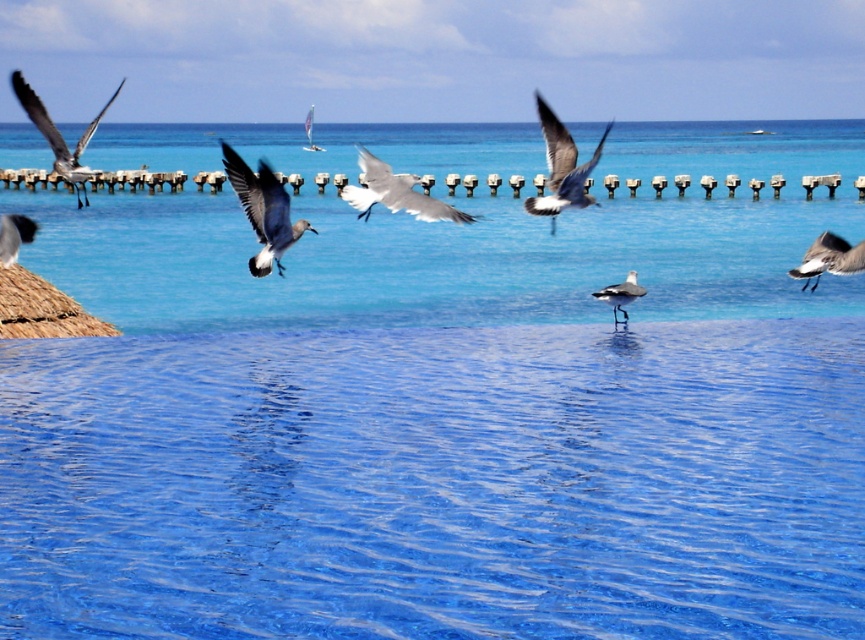
Question: Which point is closer to the camera?

Choices:
 (A) gray matte seagull at upper left
 (B) white glossy seagull at center
 (C) white matte bird at center
 (D) white feathered seagull at right

Answer: (B)

Question: Does white glossy seagull at center appear on the right side of matte black bird at left?

Choices:
 (A) yes
 (B) no

Answer: (A)

Question: Which object is farther from the camera taking this photo?

Choices:
 (A) gray matte seagull at upper center
 (B) white matte bird at center

Answer: (B)

Question: Does gray matte seagull at upper center have a larger size compared to matte black bird at left?

Choices:
 (A) yes
 (B) no

Answer: (A)

Question: Based on their relative distances, which object is nearer to the gray matte seagull at upper left?

Choices:
 (A) white matte bird at center
 (B) gray matte seagull at center

Answer: (B)

Question: Is white glossy seagull at center further to the viewer compared to white matte bird at center?

Choices:
 (A) no
 (B) yes

Answer: (A)